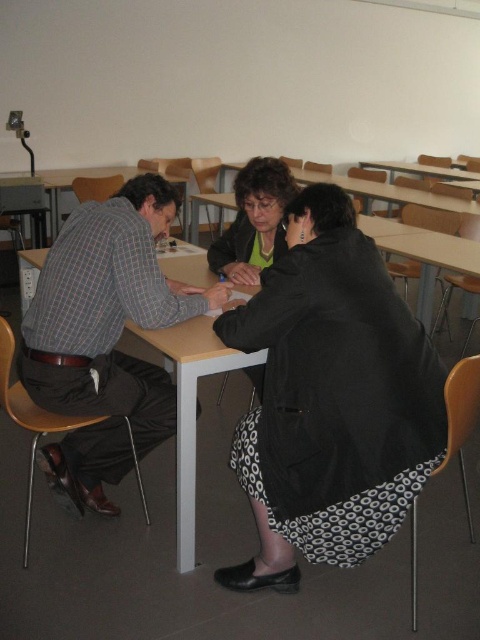
Question: Which point is closer to the camera?

Choices:
 (A) (37, 176)
 (B) (296, 376)
 (C) (251, 204)

Answer: (B)

Question: Which object appears farthest from the camera in this image?

Choices:
 (A) wooden table at left
 (B) matte black jacket at center
 (C) black textured skirt at lower center
 (D) plaid fabric shirt at left

Answer: (A)

Question: Is plaid fabric shirt at left to the right of wooden table at left from the viewer's perspective?

Choices:
 (A) no
 (B) yes

Answer: (B)

Question: Does matte black jacket at center appear under wooden table at left?

Choices:
 (A) yes
 (B) no

Answer: (A)

Question: Which is farther from the wooden table at left?

Choices:
 (A) matte black jacket at center
 (B) black textured skirt at lower center

Answer: (B)

Question: Observing the image, what is the correct spatial positioning of matte black jacket at center in reference to wooden table at left?

Choices:
 (A) above
 (B) below

Answer: (B)